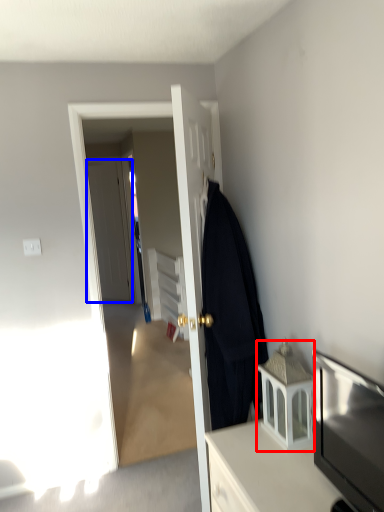
Question: Which object appears closest to the camera in this image, cabinetry (highlighted by a red box) or door (highlighted by a blue box)?

Choices:
 (A) cabinetry
 (B) door

Answer: (A)